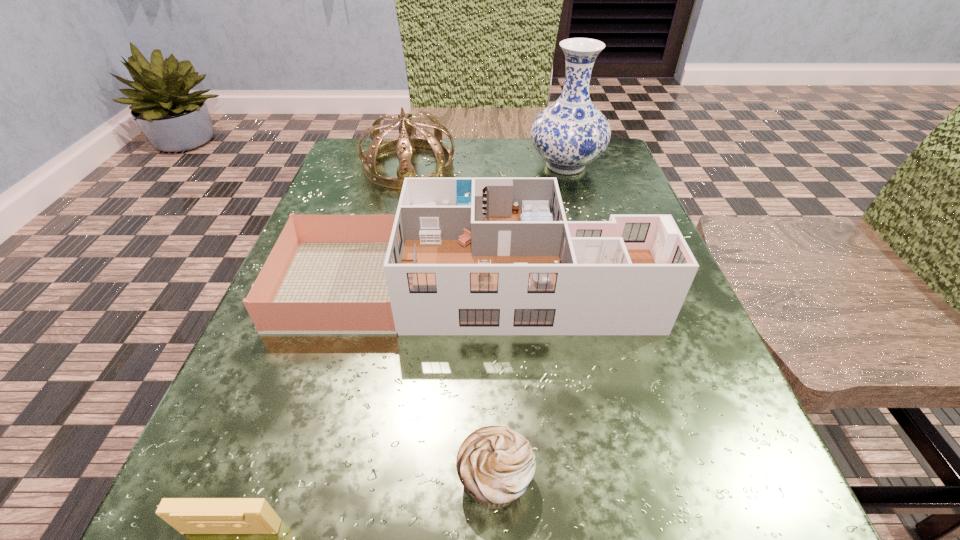
Find the location of a particular element. vacant space at the far edge is located at coordinates (415, 158).

At what (x,y) coordinates should I click in order to perform the action: click on free space at the left edge of the desktop. Please return your answer as a coordinate pair (x, y). This screenshot has width=960, height=540. Looking at the image, I should click on point(396,200).

Locate an element on the screen. The image size is (960, 540). free region at the right edge of the desktop is located at coordinates (600, 372).

Image resolution: width=960 pixels, height=540 pixels. What are the coordinates of `blank area at the far left corner` in the screenshot? It's located at (387, 153).

This screenshot has width=960, height=540. I want to click on vacant space at the far right corner of the desktop, so click(x=623, y=173).

The image size is (960, 540). In order to click on vacant space at the near right corner in this screenshot , I will do `click(643, 539)`.

Identify the location of empty location between the nearest object and the fourth farthest object. (363, 503).

Where is `free spot between the nearest object and the muffin`? free spot between the nearest object and the muffin is located at coordinates (363, 503).

This screenshot has width=960, height=540. I want to click on free space between the tiara and the vase, so click(x=487, y=166).

You are a GUI agent. You are given a task and a screenshot of the screen. Output one action in this format:
    pyautogui.click(x=<x>, y=<y>)
    Task: Click on the free space between the videotape and the muffin
    Image resolution: width=960 pixels, height=540 pixels.
    Given the screenshot: What is the action you would take?
    pyautogui.click(x=363, y=503)